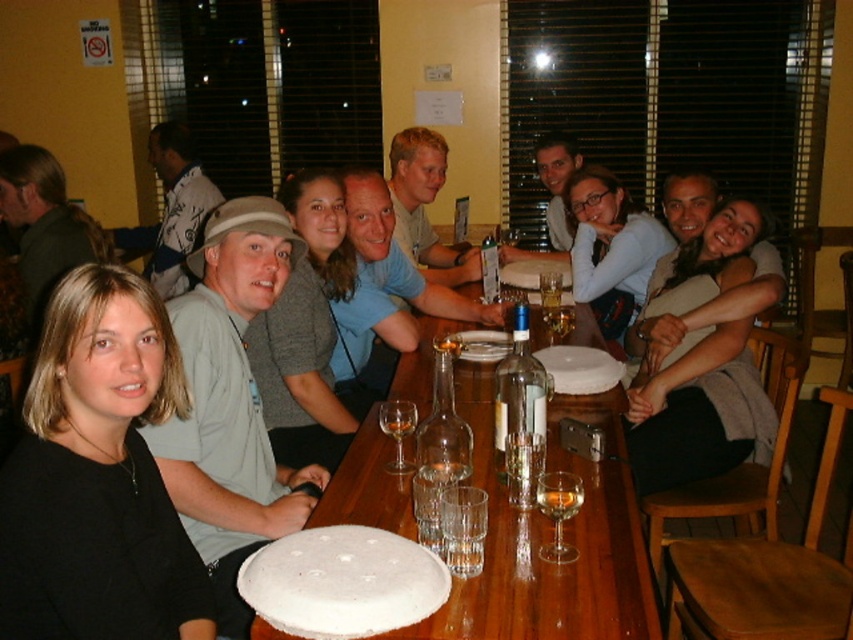
Question: Does translucent glass wine at table center appear over translucent glass at table center?

Choices:
 (A) no
 (B) yes

Answer: (A)

Question: Can you confirm if light brown sweater at center is positioned below clear glass wine at table center?

Choices:
 (A) no
 (B) yes

Answer: (A)

Question: Estimate the real-world distances between objects in this image. Which object is closer to the clear glass wine at table center?

Choices:
 (A) translucent glass wine at table center
 (B) clear glass at table center
 (C) wooden table at center
 (D) light brown sweater at center

Answer: (C)

Question: Which of the following is the closest to the observer?

Choices:
 (A) (547, 500)
 (B) (79, 570)
 (C) (722, 349)
 (D) (467, 538)

Answer: (B)

Question: In this image, where is black fabric at left located relative to clear glass at table center?

Choices:
 (A) below
 (B) above

Answer: (B)

Question: Considering the real-world distances, which object is farthest from the translucent glass wine at table center?

Choices:
 (A) wooden table at center
 (B) clear glass at table center
 (C) black fabric at left

Answer: (C)